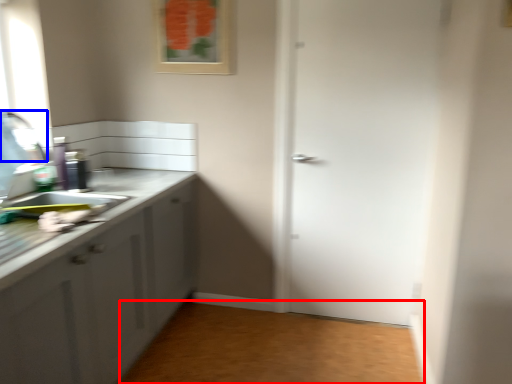
Question: Which of the following is the closest to the observer, plain (highlighted by a red box) or faucet (highlighted by a blue box)?

Choices:
 (A) plain
 (B) faucet

Answer: (B)